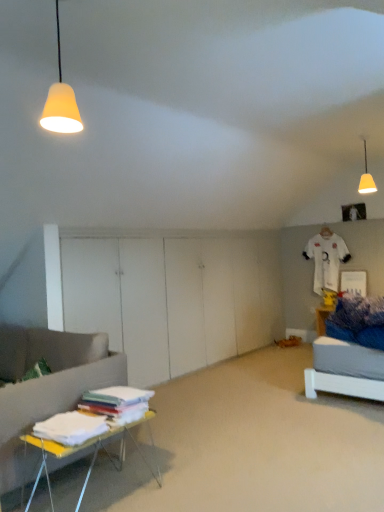
Question: Can you confirm if matte yellow lampshade at upper right, the 1th lamp from the right, is positioned to the right of white fabric stack at lower left?

Choices:
 (A) no
 (B) yes

Answer: (B)

Question: From a real-world perspective, is matte yellow lampshade at upper right, the second lamp viewed from the front, physically above white fabric stack at lower left?

Choices:
 (A) no
 (B) yes

Answer: (B)

Question: From the image's perspective, does matte yellow lampshade at upper right, which is the 1th lamp from back to front, appear higher than white fabric stack at lower left?

Choices:
 (A) no
 (B) yes

Answer: (B)

Question: Is matte yellow lampshade at upper right, the 1th lamp from the right, with white fabric stack at lower left?

Choices:
 (A) no
 (B) yes

Answer: (A)

Question: Considering the relative sizes of matte yellow lampshade at upper right, acting as the second lamp starting from the left, and white fabric stack at lower left in the image provided, is matte yellow lampshade at upper right, acting as the second lamp starting from the left, shorter than white fabric stack at lower left?

Choices:
 (A) yes
 (B) no

Answer: (B)

Question: Is matte yellow lampshade at upper right, the 1th lamp from the right, positioned far away from white fabric stack at lower left?

Choices:
 (A) yes
 (B) no

Answer: (A)

Question: From the image's perspective, is matte yellow cone at upper left, positioned as the first lamp in front-to-back order, located above matte yellow lampshade at upper right, the second lamp viewed from the front?

Choices:
 (A) yes
 (B) no

Answer: (B)

Question: Does matte yellow cone at upper left, positioned as the first lamp in front-to-back order, have a lesser width compared to matte yellow lampshade at upper right, acting as the second lamp starting from the left?

Choices:
 (A) no
 (B) yes

Answer: (B)

Question: Is matte yellow cone at upper left, arranged as the second lamp when viewed from the back, looking in the opposite direction of matte yellow lampshade at upper right, the second lamp viewed from the front?

Choices:
 (A) no
 (B) yes

Answer: (A)

Question: Is matte yellow cone at upper left, positioned as the first lamp in front-to-back order, in contact with matte yellow lampshade at upper right, the second lamp viewed from the front?

Choices:
 (A) yes
 (B) no

Answer: (B)

Question: Is matte yellow cone at upper left, arranged as the second lamp when viewed from the back, outside of matte yellow lampshade at upper right, the second lamp viewed from the front?

Choices:
 (A) no
 (B) yes

Answer: (B)

Question: Does matte yellow cone at upper left, positioned as the first lamp in front-to-back order, have a lesser height compared to matte yellow lampshade at upper right, which is the 1th lamp from back to front?

Choices:
 (A) yes
 (B) no

Answer: (B)

Question: From a real-world perspective, is matte yellow cone at upper left, the 1th lamp viewed from the left, positioned over white fabric stack at lower left based on gravity?

Choices:
 (A) no
 (B) yes

Answer: (B)